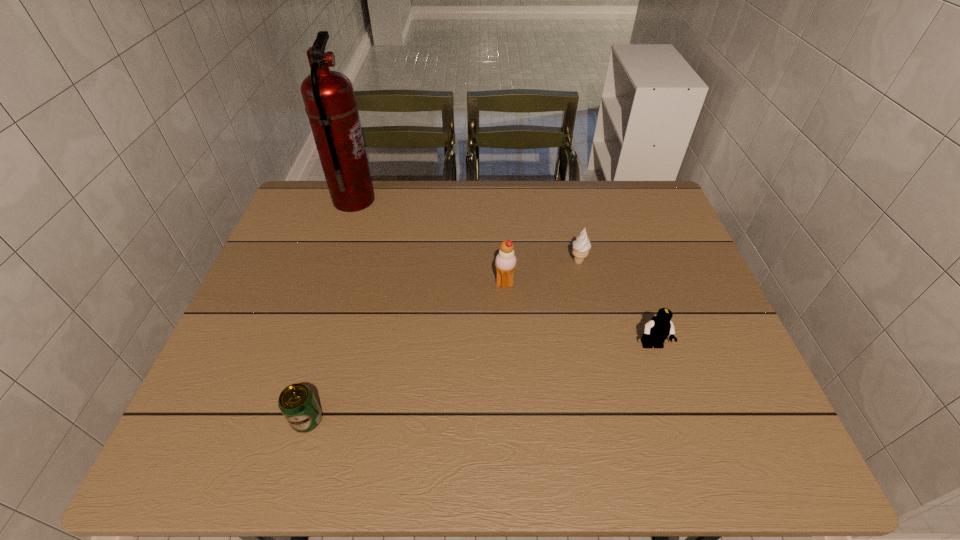
Locate an element on the screen. Image resolution: width=960 pixels, height=540 pixels. the tallest object is located at coordinates (328, 96).

Identify the location of fire extinguisher. The height and width of the screenshot is (540, 960). (328, 96).

This screenshot has height=540, width=960. In order to click on the left icecream in this screenshot , I will do `click(505, 262)`.

This screenshot has width=960, height=540. Find the location of `the second tallest object`. the second tallest object is located at coordinates (505, 262).

Find the location of `the right icecream`. the right icecream is located at coordinates click(x=581, y=246).

Where is `the shorter icecream`? The image size is (960, 540). the shorter icecream is located at coordinates (581, 246).

Find the location of a particular element. This screenshot has height=540, width=960. the rightmost object is located at coordinates (656, 331).

At what (x,y) coordinates should I click in order to perform the action: click on Lego. Please return your answer as a coordinate pair (x, y). The image size is (960, 540). Looking at the image, I should click on coord(656,331).

Where is `beer can`? This screenshot has height=540, width=960. beer can is located at coordinates (297, 402).

This screenshot has width=960, height=540. Identify the location of the nearest object. (297, 402).